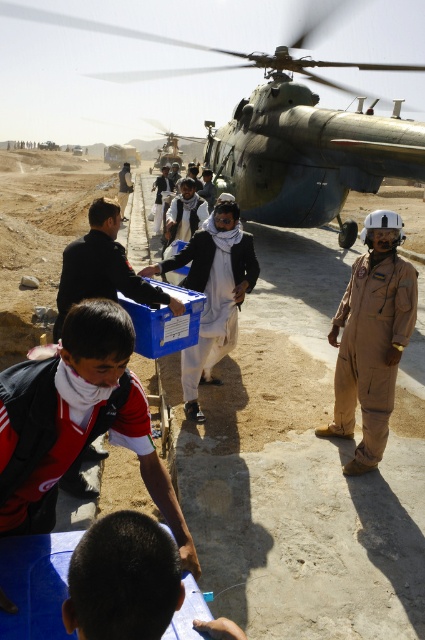
You are a drone operator who needs to fly a drone from the matte black shirt at center to the metallic gray helicopter at upper center. What is the minimum distance you need to cover?

The minimum distance between the matte black shirt at center and the metallic gray helicopter at upper center is 28.39 meters, so you need to cover at least 28.39 meters.

You are a photographer positioned at the back of the scene. You want to take a photo of both the red shirt at center and the brown hair at lower center. However, you notice that one of them is blocking the other. Which person should you ask to move forward so that both are visible in the photo?

The brown hair at lower center is behind the red shirt at center, so you should ask the brown hair at lower center to move forward so that both are visible in the photo.

You are a photographer standing at the edge of the desert. You want to take a photo of the metallic gray helicopter at upper center without any people blocking it. Is the matte black shirt at center currently blocking your view of the helicopter?

The matte black shirt at center is in front of the metallic gray helicopter at upper center, so it is blocking the view of the helicopter. You would need to move around or wait for the person to move to capture an unobstructed image.